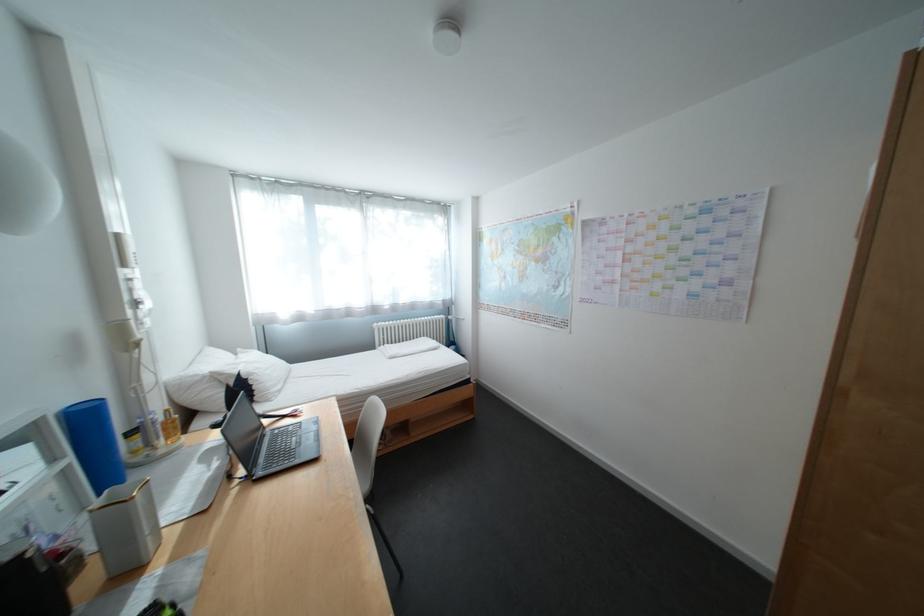
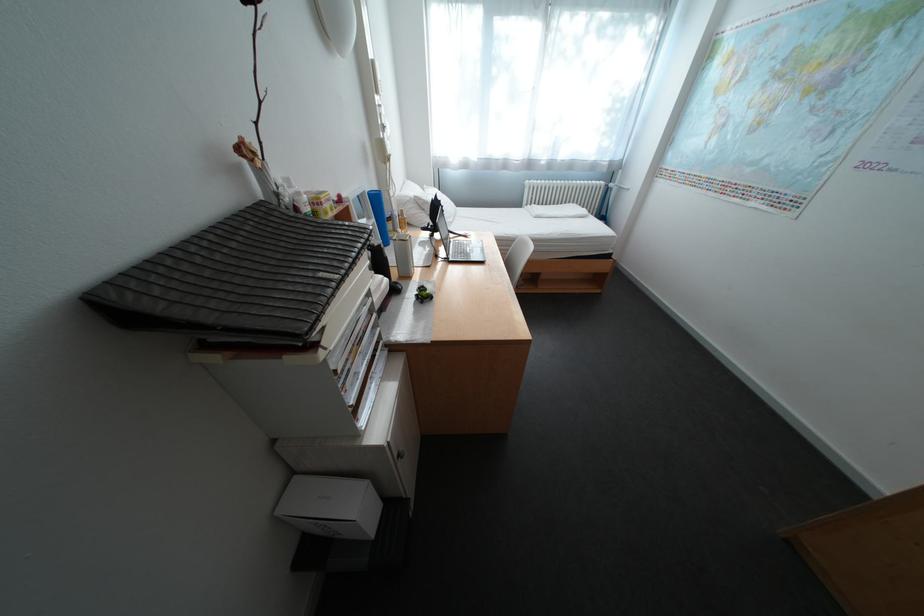
Locate, in the second image, the point that corresponds to the point at 297,416 in the first image.

(472, 236)